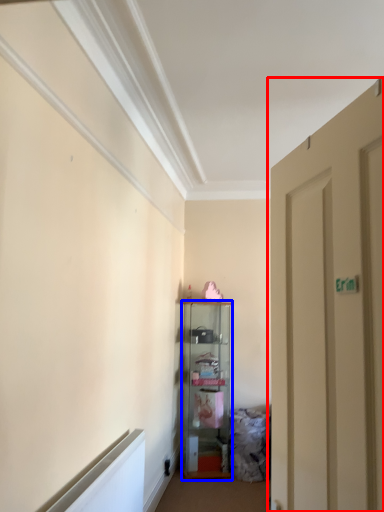
Question: Among these objects, which one is nearest to the camera, door (highlighted by a red box) or cabinetry (highlighted by a blue box)?

Choices:
 (A) door
 (B) cabinetry

Answer: (A)